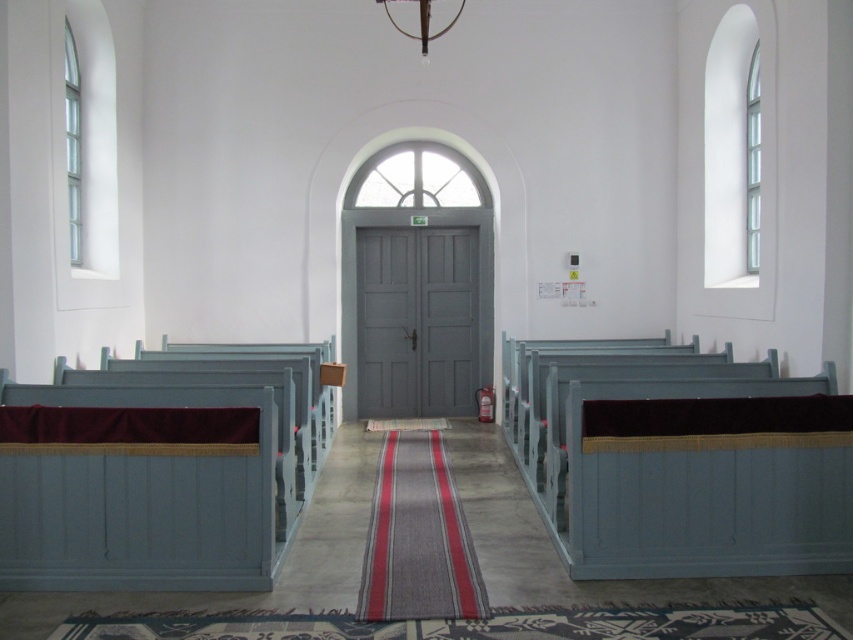
You are a visitor planning to sit on one of the benches in the church. The church has a matte blue wood bench at left and a matte blue wood church bench at right. Which bench would you choose if you want more space to stretch your legs?

The matte blue wood church bench at right has a greater width compared to the matte blue wood bench at left, so you should choose the matte blue wood church bench at right for more space to stretch your legs.